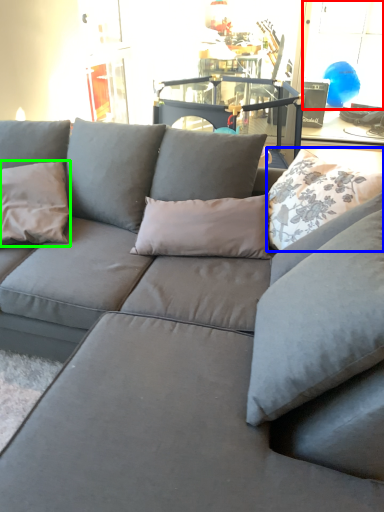
Question: Which object is the closest to the window (highlighted by a red box)? Choose among these: pillow (highlighted by a blue box) or pillow (highlighted by a green box).

Choices:
 (A) pillow
 (B) pillow

Answer: (A)